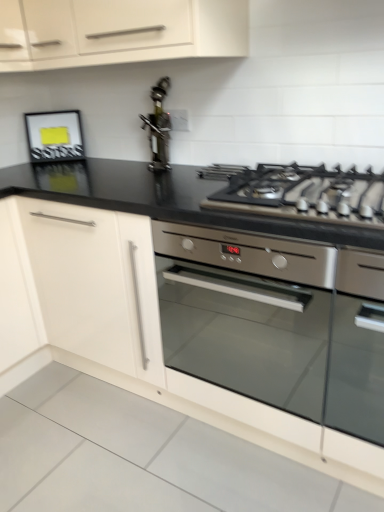
You are a GUI agent. You are given a task and a screenshot of the screen. Output one action in this format:
    pyautogui.click(x=<x>, y=<y>)
    Task: Click on the satin silver gas stove at upper right
    This screenshot has width=384, height=512.
    Given the screenshot: What is the action you would take?
    pyautogui.click(x=305, y=194)

The width and height of the screenshot is (384, 512). Describe the element at coordinates (247, 312) in the screenshot. I see `satin silver oven at center` at that location.

What do you see at coordinates (54, 136) in the screenshot? I see `matte black frame at upper left` at bounding box center [54, 136].

In order to click on white matte cabinet at upper left, placed as the 2th cabinetry when sorted from bottom to top in this screenshot , I will do `click(118, 31)`.

Is matte black frame at upper left oriented towards white matte cabinet at upper left, arranged as the 1th cabinetry when viewed from the top?

No, matte black frame at upper left is not oriented towards white matte cabinet at upper left, arranged as the 1th cabinetry when viewed from the top.

How much distance is there between matte black frame at upper left and white matte cabinet at upper left, arranged as the 1th cabinetry when viewed from the top?

matte black frame at upper left is 58.83 centimeters from white matte cabinet at upper left, arranged as the 1th cabinetry when viewed from the top.

How many degrees apart are the facing directions of matte black frame at upper left and white matte cabinet at upper left, arranged as the 1th cabinetry when viewed from the top?

The angular difference between matte black frame at upper left and white matte cabinet at upper left, arranged as the 1th cabinetry when viewed from the top, is 40.6 degrees.

Would you say matte black frame at upper left is inside or outside white matte cabinet at upper left, placed as the 2th cabinetry when sorted from bottom to top?

The correct answer is: outside.

Are satin silver gas stove at upper right and white matte cabinet at upper left, arranged as the 1th cabinetry when viewed from the top, far apart?

No, satin silver gas stove at upper right is in close proximity to white matte cabinet at upper left, arranged as the 1th cabinetry when viewed from the top.

At what (x,y) coordinates should I click in order to perform the action: click on gas stove in front of the white matte cabinet at upper left, arranged as the 1th cabinetry when viewed from the top. Please return your answer as a coordinate pair (x, y). The height and width of the screenshot is (512, 384). Looking at the image, I should click on (305, 194).

Consider the image. Considering their positions, is satin silver gas stove at upper right located in front of or behind white matte cabinet at upper left, arranged as the 1th cabinetry when viewed from the top?

satin silver gas stove at upper right is in front of white matte cabinet at upper left, arranged as the 1th cabinetry when viewed from the top.

From the image's perspective, is satin silver gas stove at upper right positioned above or below white matte cabinet at upper left, placed as the 2th cabinetry when sorted from bottom to top?

Based on their image positions, satin silver gas stove at upper right is located beneath white matte cabinet at upper left, placed as the 2th cabinetry when sorted from bottom to top.

Is satin silver oven at center looking in the opposite direction of white matte cabinet at upper left, placed as the 2th cabinetry when sorted from bottom to top?

No.

From the image's perspective, which one is positioned higher, satin silver oven at center or white matte cabinet at upper left, placed as the 2th cabinetry when sorted from bottom to top?

white matte cabinet at upper left, placed as the 2th cabinetry when sorted from bottom to top.

Considering their positions, is satin silver oven at center located in front of or behind white matte cabinet at upper left, placed as the 2th cabinetry when sorted from bottom to top?

satin silver oven at center is positioned closer to the viewer than white matte cabinet at upper left, placed as the 2th cabinetry when sorted from bottom to top.

Which object is positioned more to the right, satin silver oven at center or white matte cabinet at upper left, arranged as the 1th cabinetry when viewed from the top?

satin silver oven at center.

Between matte black frame at upper left and satin silver gas stove at upper right, which one has larger width?

satin silver gas stove at upper right is wider.

Which of these two, matte black frame at upper left or satin silver gas stove at upper right, is bigger?

With larger size is satin silver gas stove at upper right.

How many degrees apart are the facing directions of matte black frame at upper left and satin silver gas stove at upper right?

They differ by 39.7 degrees in their facing directions.

From a real-world perspective, is satin silver gas stove at upper right under white matte cabinet at left, the first cabinetry positioned from the bottom?

Incorrect, from a real-world perspective, satin silver gas stove at upper right is higher than white matte cabinet at left, the first cabinetry positioned from the bottom.

From the image's perspective, is satin silver gas stove at upper right above or below white matte cabinet at left, the 2th cabinetry positioned from the top?

satin silver gas stove at upper right is above white matte cabinet at left, the 2th cabinetry positioned from the top.

Is satin silver gas stove at upper right not inside white matte cabinet at left, the first cabinetry positioned from the bottom?

Absolutely, satin silver gas stove at upper right is external to white matte cabinet at left, the first cabinetry positioned from the bottom.

Which object is thinner, satin silver gas stove at upper right or white matte cabinet at left, the first cabinetry positioned from the bottom?

With smaller width is white matte cabinet at left, the first cabinetry positioned from the bottom.

Is satin silver gas stove at upper right facing towards satin silver oven at center?

No, satin silver gas stove at upper right is not turned towards satin silver oven at center.

Would you consider satin silver gas stove at upper right to be distant from satin silver oven at center?

satin silver gas stove at upper right is near satin silver oven at center, not far away.

From a real-world perspective, is satin silver gas stove at upper right physically located above or below satin silver oven at center?

In terms of real-world spatial position, satin silver gas stove at upper right is above satin silver oven at center.

Is satin silver gas stove at upper right in front of satin silver oven at center?

Yes, satin silver gas stove at upper right is closer to the viewer.

This screenshot has width=384, height=512. What are the coordinates of `the 1st cabinetry in front when counting from the matte black frame at upper left` in the screenshot? It's located at (92, 283).

Relative to matte black frame at upper left, is white matte cabinet at left, the 2th cabinetry positioned from the top, in front or behind?

white matte cabinet at left, the 2th cabinetry positioned from the top, is positioned closer to the viewer than matte black frame at upper left.

From the image's perspective, between white matte cabinet at left, the first cabinetry positioned from the bottom, and matte black frame at upper left, which one is located above?

From the image's view, matte black frame at upper left is above.

Identify the location of cabinetry above the matte black frame at upper left (from the image's perspective). This screenshot has height=512, width=384. (118, 31).

Locate an element on the screen. gas stove below the white matte cabinet at upper left, arranged as the 1th cabinetry when viewed from the top (from the image's perspective) is located at coordinates (305, 194).

Considering their positions, is matte black frame at upper left positioned further to stainless steel oil dispenser at center than white matte cabinet at upper left, arranged as the 1th cabinetry when viewed from the top?

matte black frame at upper left is further to stainless steel oil dispenser at center.

When comparing their distances from white matte cabinet at left, the 2th cabinetry positioned from the top, does stainless steel oil dispenser at center or satin silver gas stove at upper right seem closer?

satin silver gas stove at upper right is closer to white matte cabinet at left, the 2th cabinetry positioned from the top.

Consider the image. When comparing their distances from stainless steel oil dispenser at center, does matte black frame at upper left or white matte cabinet at left, the first cabinetry positioned from the bottom, seem further?

Among the two, white matte cabinet at left, the first cabinetry positioned from the bottom, is located further to stainless steel oil dispenser at center.

From the image, which object appears to be farther from matte black frame at upper left, satin silver oven at center or white matte cabinet at left, the first cabinetry positioned from the bottom?

satin silver oven at center is positioned further to the anchor matte black frame at upper left.

Based on their spatial positions, is satin silver gas stove at upper right or white matte cabinet at left, the 2th cabinetry positioned from the top, closer to white matte cabinet at upper left, placed as the 2th cabinetry when sorted from bottom to top?

The object closer to white matte cabinet at upper left, placed as the 2th cabinetry when sorted from bottom to top, is satin silver gas stove at upper right.

Estimate the real-world distances between objects in this image. Which object is further from matte black frame at upper left, stainless steel oil dispenser at center or white matte cabinet at upper left, placed as the 2th cabinetry when sorted from bottom to top?

Based on the image, white matte cabinet at upper left, placed as the 2th cabinetry when sorted from bottom to top, appears to be further to matte black frame at upper left.

Consider the image. When comparing their distances from white matte cabinet at left, the first cabinetry positioned from the bottom, does satin silver oven at center or satin silver gas stove at upper right seem closer?

satin silver oven at center.

Looking at the image, which one is located closer to stainless steel oil dispenser at center, satin silver oven at center or matte black frame at upper left?

The object closer to stainless steel oil dispenser at center is matte black frame at upper left.

Locate an element on the screen. The height and width of the screenshot is (512, 384). picture frame between white matte cabinet at left, the 2th cabinetry positioned from the top, and satin silver gas stove at upper right is located at coordinates (54, 136).

You are a GUI agent. You are given a task and a screenshot of the screen. Output one action in this format:
    pyautogui.click(x=<x>, y=<y>)
    Task: Click on the picture frame between white matte cabinet at upper left, arranged as the 1th cabinetry when viewed from the top, and white matte cabinet at left, the first cabinetry positioned from the bottom, in the up-down direction
    The height and width of the screenshot is (512, 384).
    Given the screenshot: What is the action you would take?
    pyautogui.click(x=54, y=136)

Where is `cabinetry between white matte cabinet at upper left, arranged as the 1th cabinetry when viewed from the top, and satin silver oven at center, in the vertical direction`? The height and width of the screenshot is (512, 384). cabinetry between white matte cabinet at upper left, arranged as the 1th cabinetry when viewed from the top, and satin silver oven at center, in the vertical direction is located at coordinates (92, 283).

Where is `home appliance situated between white matte cabinet at left, the first cabinetry positioned from the bottom, and satin silver gas stove at upper right from left to right`? home appliance situated between white matte cabinet at left, the first cabinetry positioned from the bottom, and satin silver gas stove at upper right from left to right is located at coordinates tap(247, 312).